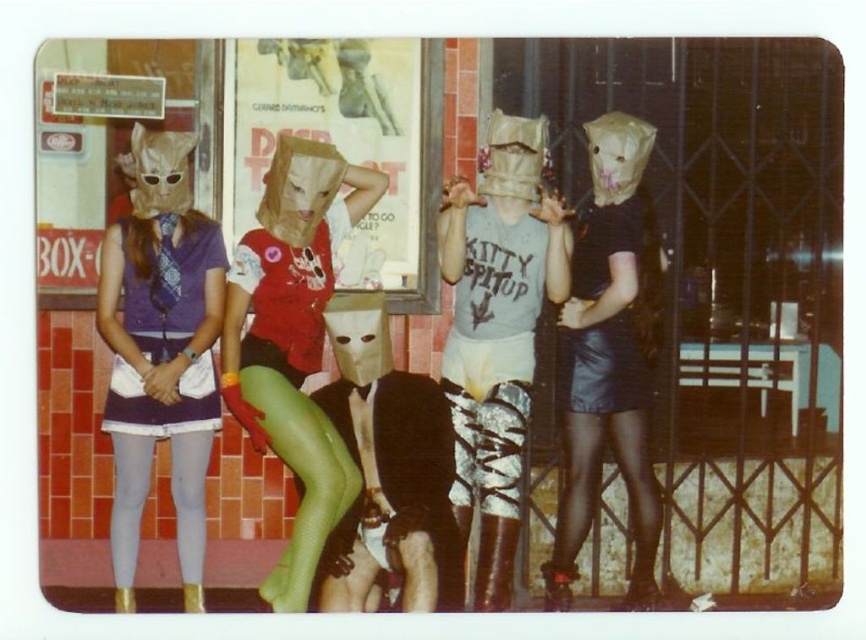
Consider the image. You are standing in front of the storefront and want to determine the relative positions of two points marked on the image. Which point is closer to you, point (505,136) or point (564,579)?

Point (505,136) is closer to the viewer than point (564,579).

In the scene shown: You are a fashion designer observing the group of people in front of the storefront. You notice the matte gray tank top at center and the green mesh tights at center. Which clothing item is closer to the observer?

The matte gray tank top at center is closer to the observer because the green mesh tights at center is behind it.